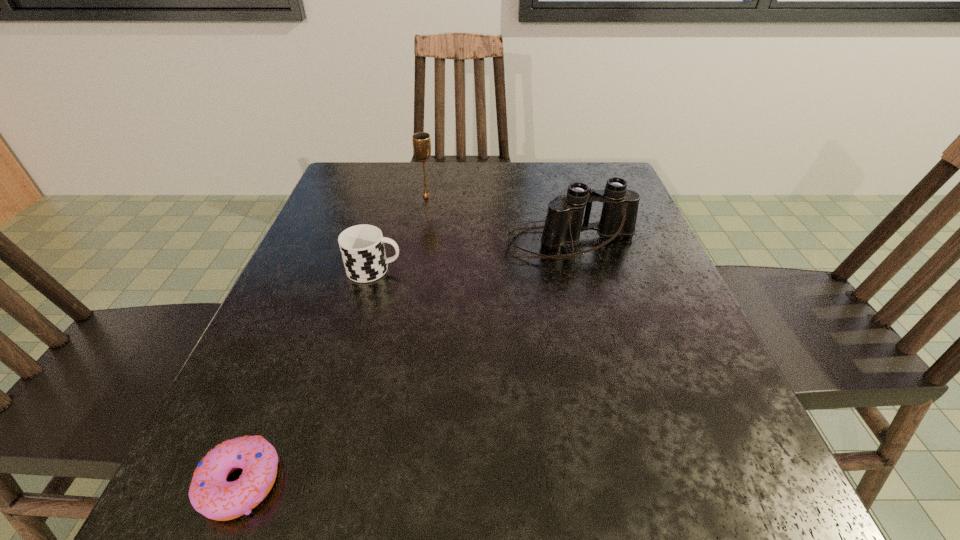
This screenshot has height=540, width=960. In order to click on object located at the far edge in this screenshot , I will do `click(421, 141)`.

Find the location of a particular element. The image size is (960, 540). object at the near edge is located at coordinates (210, 494).

Locate an element on the screen. Image resolution: width=960 pixels, height=540 pixels. cup present at the left edge is located at coordinates (362, 248).

Locate an element on the screen. doughnut present at the left edge is located at coordinates (210, 494).

Identify the location of object located in the right edge section of the desktop. [x=563, y=224].

Image resolution: width=960 pixels, height=540 pixels. Identify the location of object located at the near left corner. (210, 494).

Where is `free spot at the far edge of the desktop`? free spot at the far edge of the desktop is located at coordinates (464, 172).

At what (x,y) coordinates should I click in order to perform the action: click on blank area at the near edge. Please return your answer as a coordinate pair (x, y). This screenshot has width=960, height=540. Looking at the image, I should click on (570, 521).

Identify the location of vacant space at the right edge of the desktop. (729, 404).

Locate an element on the screen. This screenshot has height=540, width=960. vacant space at the far left corner of the desktop is located at coordinates tap(336, 209).